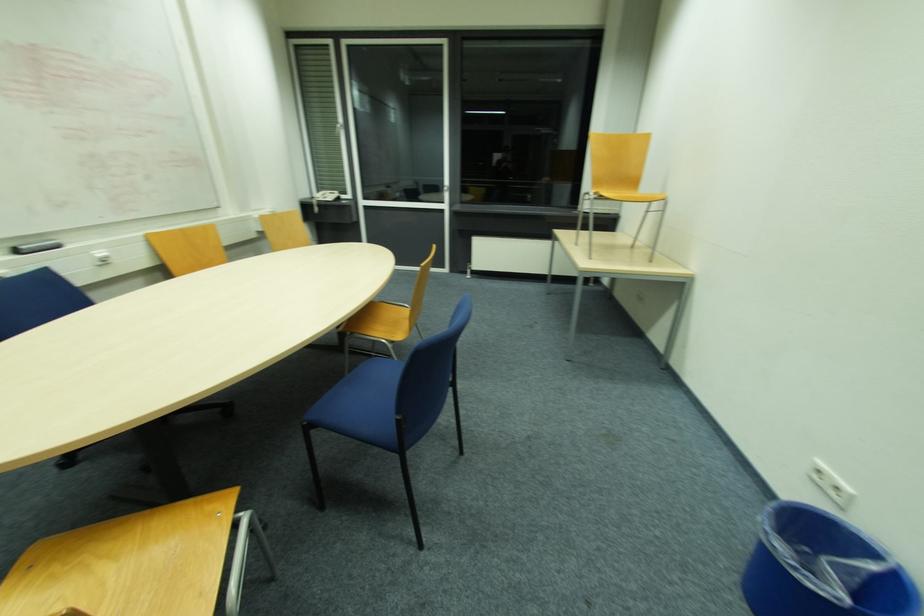
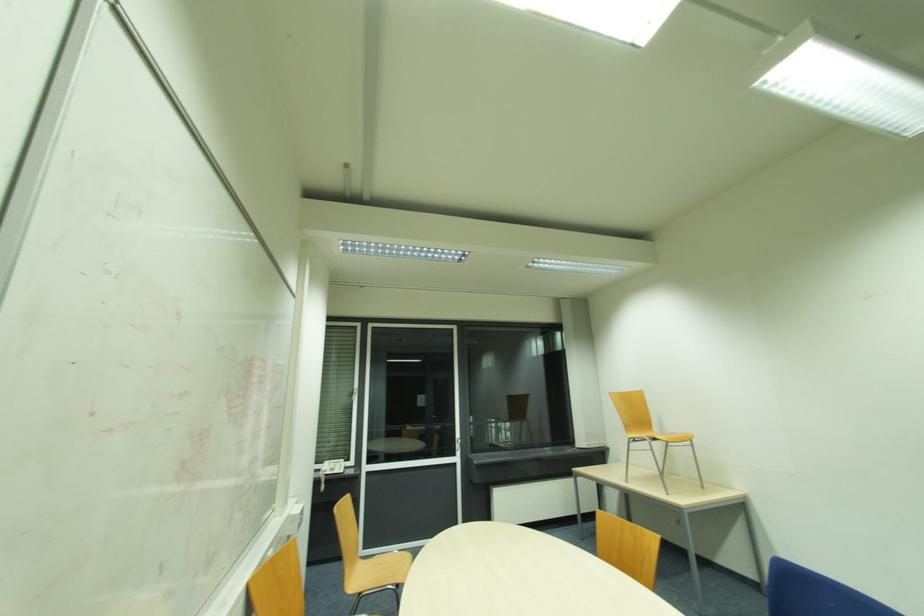
In the second image, find the point that corresponds to (x=333, y=193) in the first image.

(334, 463)